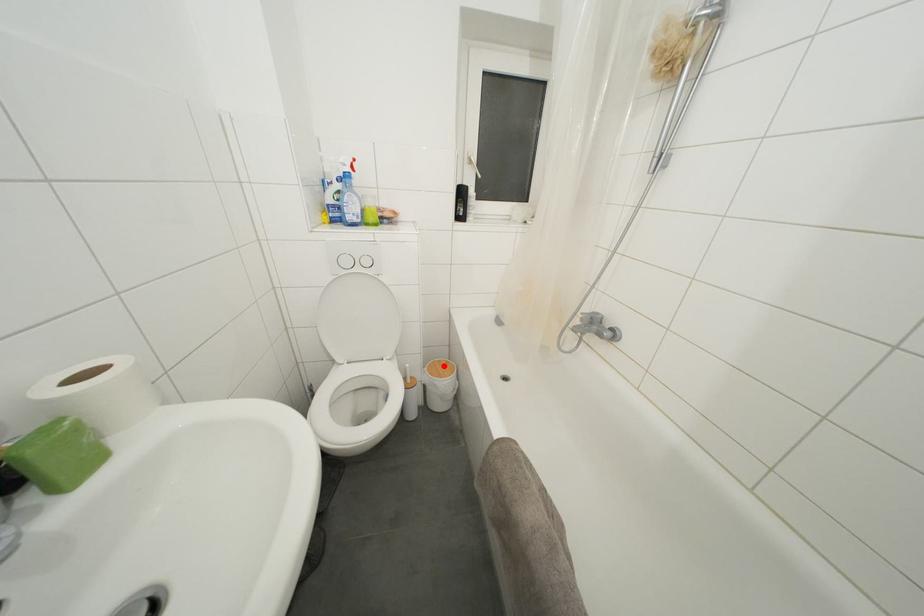
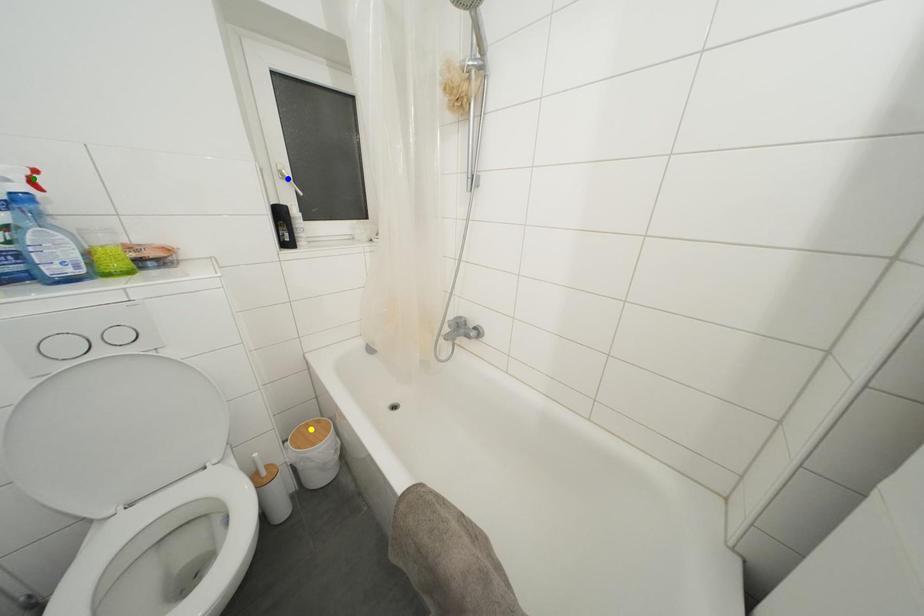
Question: I am providing you with two images of the same scene from different viewpoints. A red point is marked on the first image. You are given multiple points on the second image. Can you choose the point in image 2 that corresponds to the point in image 1?

Choices:
 (A) blue point
 (B) green point
 (C) yellow point

Answer: (C)